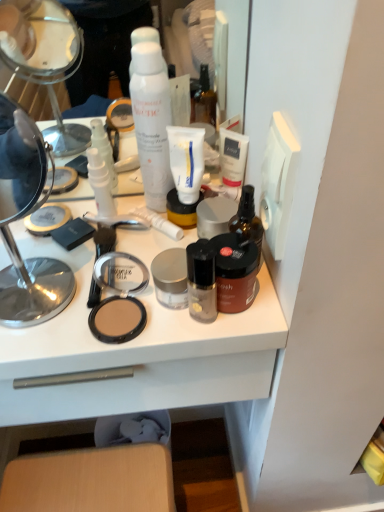
The image size is (384, 512). Identify the location of vacant position to the left of transparent plastic bottles at center, positioned as the first toiletry in left-to-right order. (50, 222).